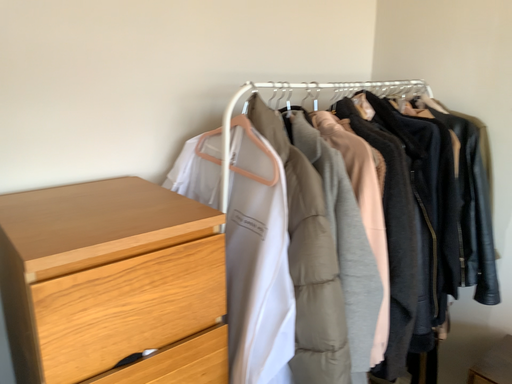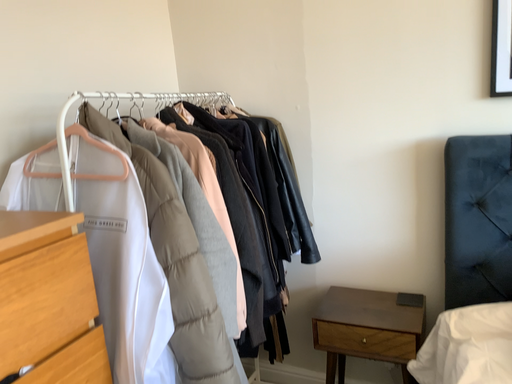
Question: How did the camera likely rotate when shooting the video?

Choices:
 (A) rotated left
 (B) rotated right

Answer: (B)